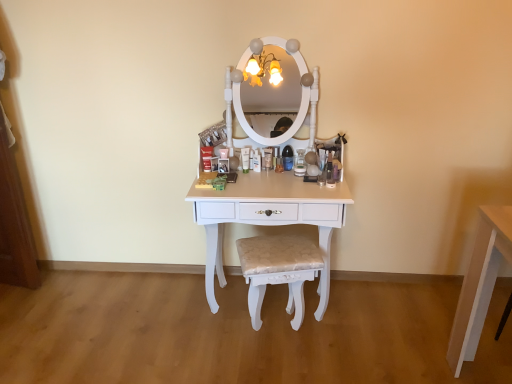
Question: From a real-world perspective, does white glossy table at center sit lower than matte white tube at center?

Choices:
 (A) no
 (B) yes

Answer: (B)

Question: Considering the relative sizes of white glossy table at center and matte white tube at center in the image provided, is white glossy table at center bigger than matte white tube at center?

Choices:
 (A) yes
 (B) no

Answer: (A)

Question: Considering the relative positions of white glossy table at center and matte white tube at center in the image provided, is white glossy table at center to the right of matte white tube at center from the viewer's perspective?

Choices:
 (A) yes
 (B) no

Answer: (A)

Question: Is white glossy table at center oriented towards matte white tube at center?

Choices:
 (A) yes
 (B) no

Answer: (B)

Question: Is white glossy table at center looking in the opposite direction of matte white tube at center?

Choices:
 (A) yes
 (B) no

Answer: (B)

Question: Is white glossy table at center shorter than matte white tube at center?

Choices:
 (A) no
 (B) yes

Answer: (A)

Question: From a real-world perspective, does beige fabric cushioned stool at center stand above white glossy table at center?

Choices:
 (A) yes
 (B) no

Answer: (B)

Question: From the image's perspective, is beige fabric cushioned stool at center under white glossy table at center?

Choices:
 (A) yes
 (B) no

Answer: (A)

Question: Is beige fabric cushioned stool at center bigger than white glossy table at center?

Choices:
 (A) yes
 (B) no

Answer: (B)

Question: Are beige fabric cushioned stool at center and white glossy table at center beside each other?

Choices:
 (A) no
 (B) yes

Answer: (A)

Question: From the image's perspective, does beige fabric cushioned stool at center appear higher than white glossy table at center?

Choices:
 (A) no
 (B) yes

Answer: (A)

Question: Would you say beige fabric cushioned stool at center contains white glossy table at center?

Choices:
 (A) yes
 (B) no

Answer: (B)

Question: Is matte white tube at center located outside beige fabric cushioned stool at center?

Choices:
 (A) yes
 (B) no

Answer: (A)